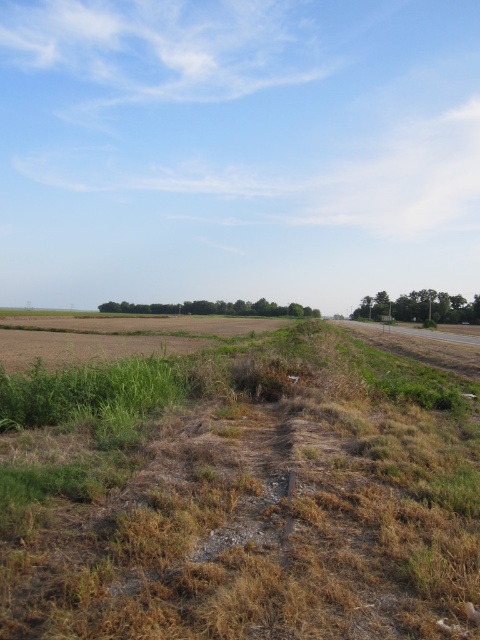
You are standing on the worn path and notice both the brown dry grass at lower left and the brown grassy dirt field at lower left. Which object is closer to you from your current position?

The brown dry grass at lower left is positioned under the brown grassy dirt field at lower left, meaning it is closer to you since it is beneath the field.

You are standing at the starting point of the path in the rural landscape. There are two points marked in the image, point A at coordinates point A is point [224,472] and point B at coordinates point B is point [143,353]. Which point is closer to you as you face the direction the path leads?

Point A at coordinates point A is point [224,472] is in front of point B at coordinates point B is point [143,353], so it is closer to you as you face the direction the path leads.